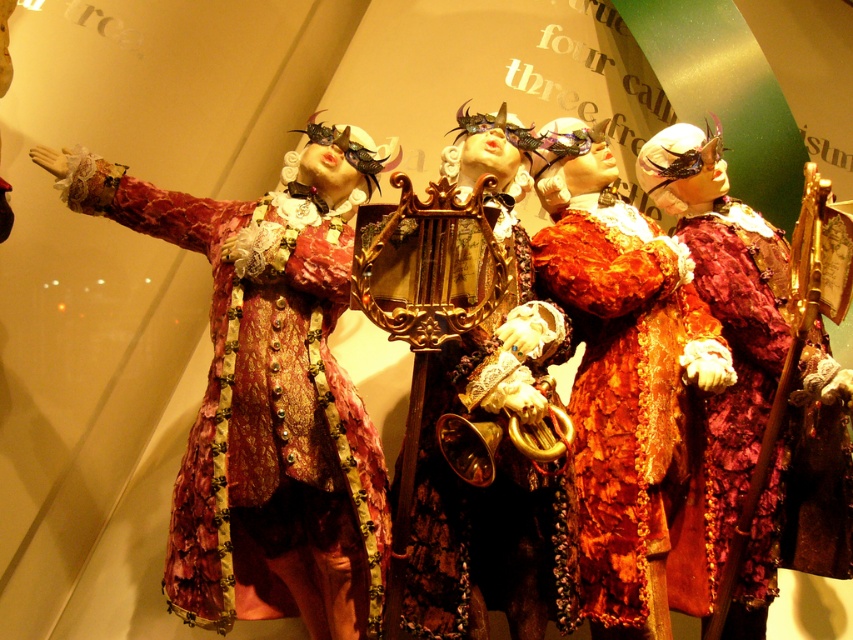
You are a costume designer trying to fit a velvet brocade coat at center and a gold metallic lyre at center into a display case. The case has a width of 1.2 meters. Can both items be placed side by side without overlapping?

The velvet brocade coat at center might be wider than the gold metallic lyre at center, but since the exact widths are not provided, it is uncertain if they can fit side by side in the 1.2 meters display case.

You are an assistant who needs to locate the exact position of the point in the image. Which object is the point at the coordinate point (267,404) located on?

The point at coordinate point (267,404) is located on the velvet brocade coat at center.